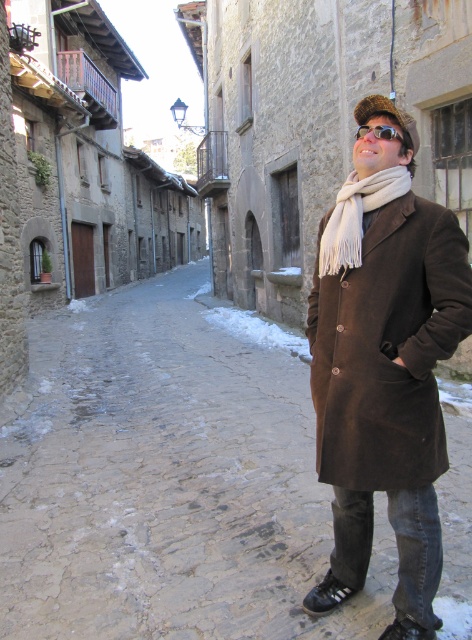
You are standing at the center of the cobblestone street and want to approach the brown suede coat at right. Which direction should you move to reach it?

To reach the brown suede coat at right, you should move to your right since it is located at the right side of the frame.